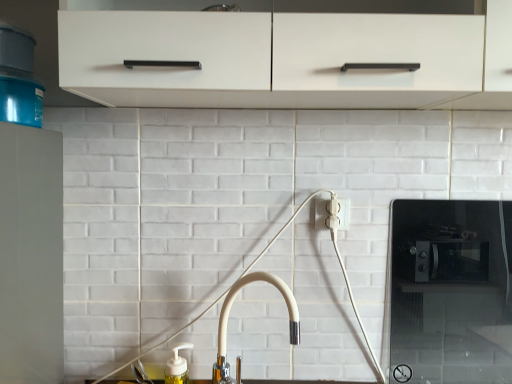
Question: Is cream matte faucet at center in front of black glass microwave at right?

Choices:
 (A) no
 (B) yes

Answer: (B)

Question: Is cream matte faucet at center shorter than black glass microwave at right?

Choices:
 (A) no
 (B) yes

Answer: (B)

Question: Is cream matte faucet at center beside black glass microwave at right?

Choices:
 (A) yes
 (B) no

Answer: (B)

Question: Can you confirm if cream matte faucet at center is positioned to the right of black glass microwave at right?

Choices:
 (A) yes
 (B) no

Answer: (B)

Question: From a real-world perspective, is cream matte faucet at center positioned over black glass microwave at right based on gravity?

Choices:
 (A) no
 (B) yes

Answer: (A)

Question: Is cream matte faucet at center behind black glass microwave at right?

Choices:
 (A) yes
 (B) no

Answer: (B)

Question: Is black glass microwave at right far away from cream matte faucet at center?

Choices:
 (A) no
 (B) yes

Answer: (A)

Question: Does black glass microwave at right have a greater height compared to cream matte faucet at center?

Choices:
 (A) no
 (B) yes

Answer: (B)

Question: Does black glass microwave at right have a greater width compared to cream matte faucet at center?

Choices:
 (A) yes
 (B) no

Answer: (B)

Question: Is black glass microwave at right turned away from cream matte faucet at center?

Choices:
 (A) no
 (B) yes

Answer: (A)

Question: From a real-world perspective, is black glass microwave at right located beneath cream matte faucet at center?

Choices:
 (A) yes
 (B) no

Answer: (B)

Question: Can you confirm if black glass microwave at right is thinner than cream matte faucet at center?

Choices:
 (A) yes
 (B) no

Answer: (A)

Question: Which is correct: cream matte faucet at center is inside black glass microwave at right, or outside of it?

Choices:
 (A) outside
 (B) inside

Answer: (A)